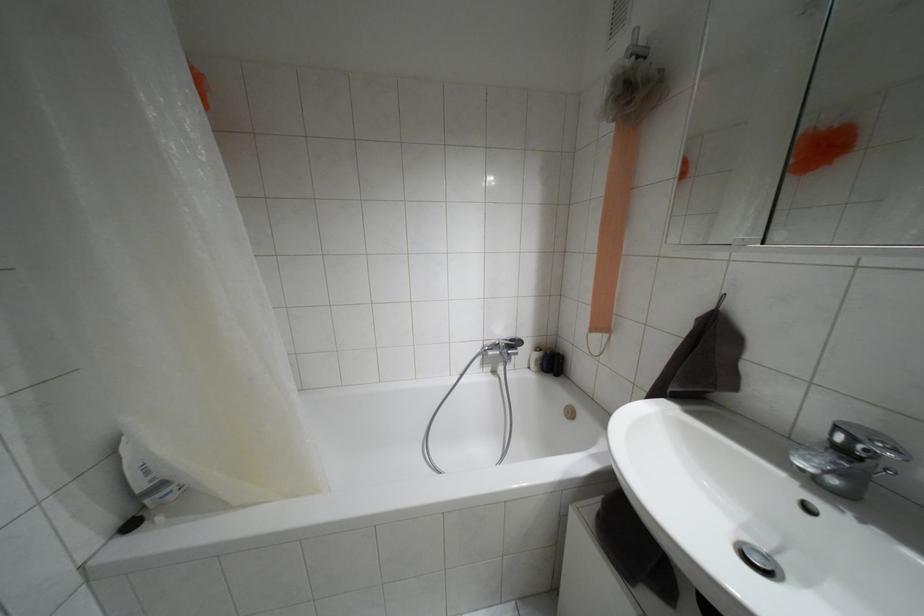
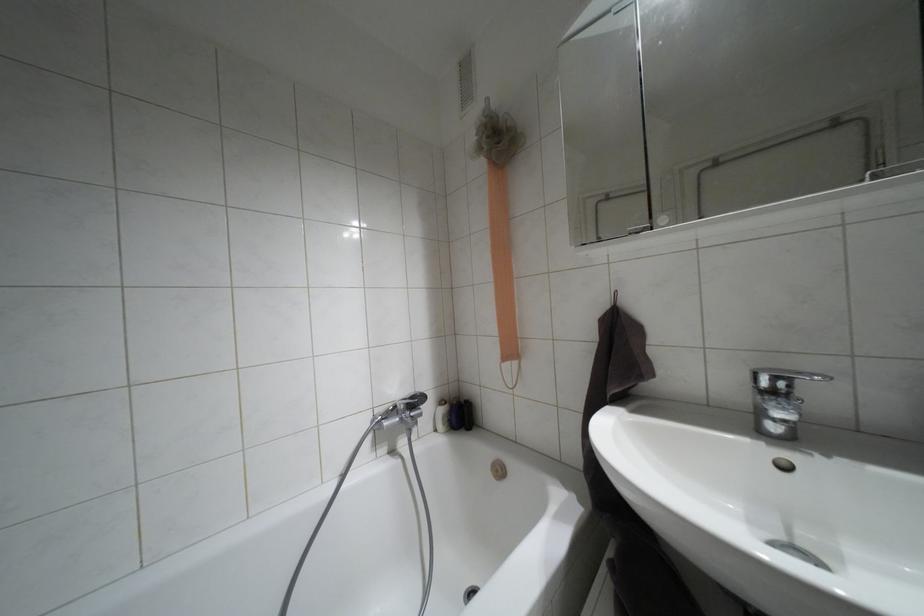
Question: The camera is either moving clockwise (left) or counter-clockwise (right) around the object. The first image is from the beginning of the video and the second image is from the end. Is the camera moving left or right when shooting the video?

Choices:
 (A) Left
 (B) Right

Answer: (A)